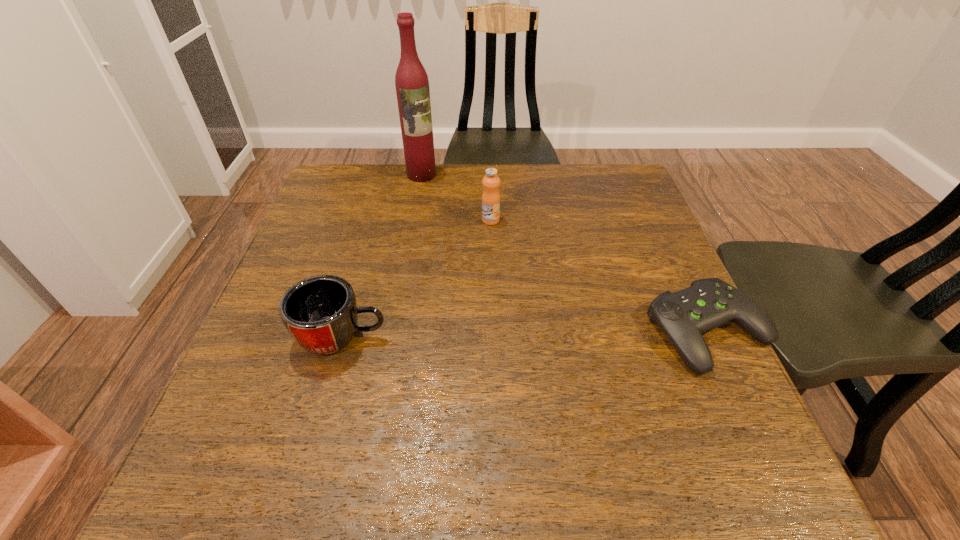
Identify the location of free space between the tallest object and the third nearest object. (456, 197).

You are a GUI agent. You are given a task and a screenshot of the screen. Output one action in this format:
    pyautogui.click(x=<x>, y=<y>)
    Task: Click on the empty space that is in between the mug and the farthest object
    
    Given the screenshot: What is the action you would take?
    pyautogui.click(x=382, y=255)

I want to click on free space between the rightmost object and the farthest object, so (x=565, y=253).

Find the location of a particular element. Image resolution: width=960 pixels, height=540 pixels. vacant area that lies between the tallest object and the third nearest object is located at coordinates (456, 197).

The width and height of the screenshot is (960, 540). In order to click on free space between the liquor and the second shortest object in this screenshot , I will do `click(382, 255)`.

This screenshot has width=960, height=540. I want to click on object that is the closest to the farthest object, so click(491, 197).

Locate an element on the screen. The width and height of the screenshot is (960, 540). object that is the third nearest to the tallest object is located at coordinates (684, 315).

Locate an element on the screen. free spot that satisfies the following two spatial constraints: 1. on the front side of the farthest object; 2. on the left side of the shortest object is located at coordinates (394, 331).